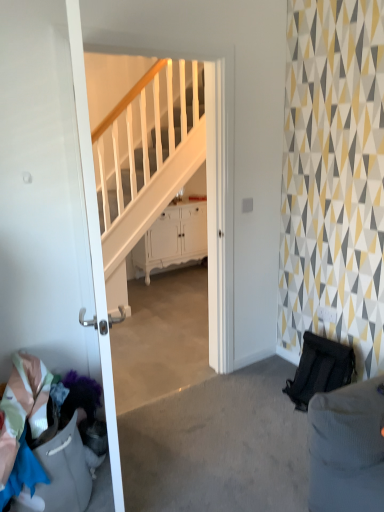
Question: Is multicolored fabric at lower left wider or thinner than white glossy door at left?

Choices:
 (A) wide
 (B) thin

Answer: (A)

Question: Relative to white glossy door at left, is multicolored fabric at lower left in front or behind?

Choices:
 (A) behind
 (B) front

Answer: (A)

Question: Which object is positioned farthest from the multicolored fabric at lower left?

Choices:
 (A) white glossy door at left
 (B) white glossy cabinet at center

Answer: (B)

Question: Which is farther from the white glossy door at left?

Choices:
 (A) white glossy cabinet at center
 (B) multicolored fabric at lower left

Answer: (A)